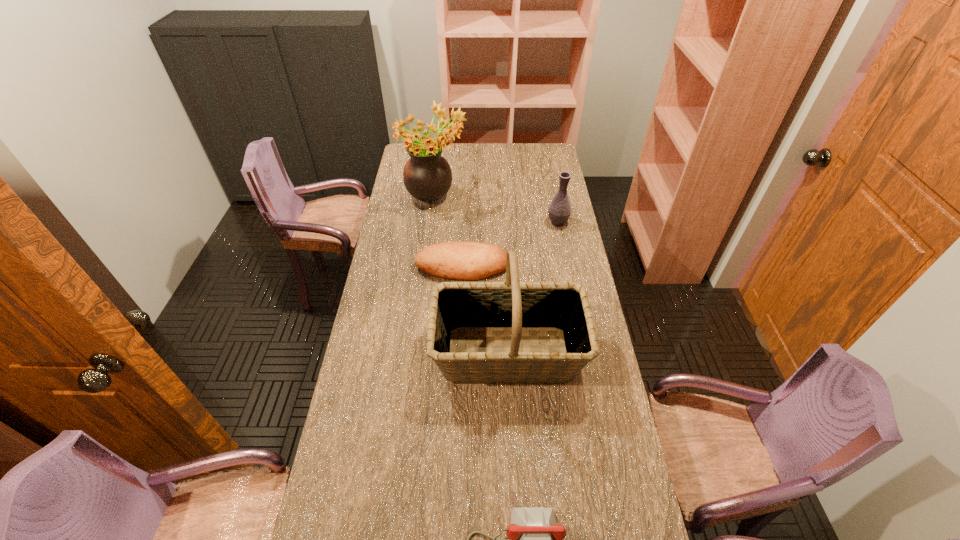
The image size is (960, 540). I want to click on flower arrangement, so click(427, 176).

Find the location of a particular element. This screenshot has width=960, height=540. the second nearest object is located at coordinates (563, 307).

The width and height of the screenshot is (960, 540). I want to click on vase, so click(559, 210).

Where is `the third farthest object`? The width and height of the screenshot is (960, 540). the third farthest object is located at coordinates (463, 260).

Locate an element on the screen. This screenshot has height=540, width=960. the second shortest object is located at coordinates (463, 260).

I want to click on vacant position located on the front of the flower arrangement, so click(x=432, y=230).

I want to click on vacant space located 0.170m by the handle of the second nearest object, so click(381, 354).

At what (x,y) coordinates should I click in order to perform the action: click on vacant region located 0.140m by the handle of the second nearest object. Please return your answer as a coordinate pair (x, y). The height and width of the screenshot is (540, 960). Looking at the image, I should click on pos(391,354).

Where is `free spot located 0.130m by the handle of the second nearest object`? This screenshot has height=540, width=960. free spot located 0.130m by the handle of the second nearest object is located at coordinates (394, 354).

At what (x,y) coordinates should I click in order to perform the action: click on vacant point located on the left of the vase. Please return your answer as a coordinate pair (x, y). This screenshot has width=960, height=540. Looking at the image, I should click on (512, 222).